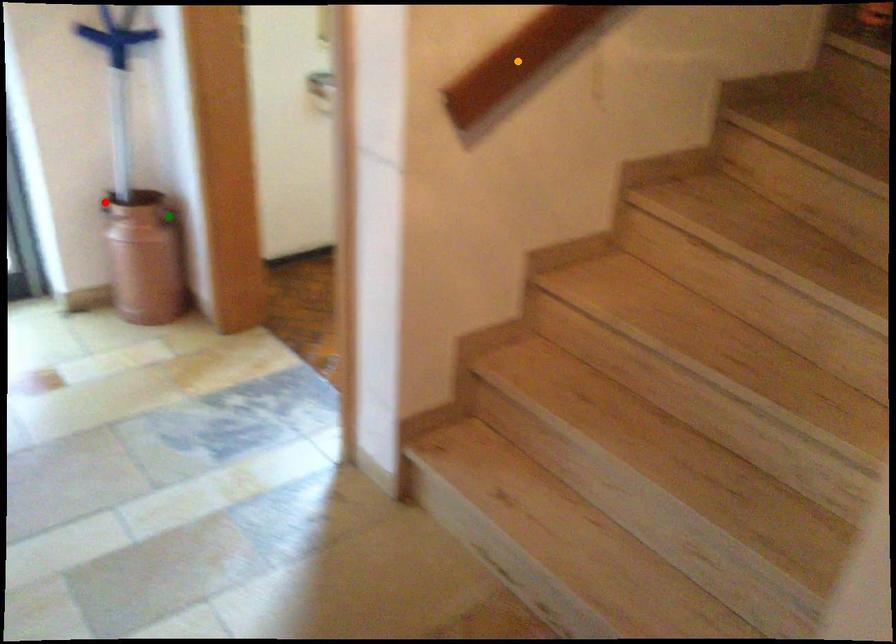
Order these from nearest to farthest:
red point | orange point | green point

orange point < green point < red point